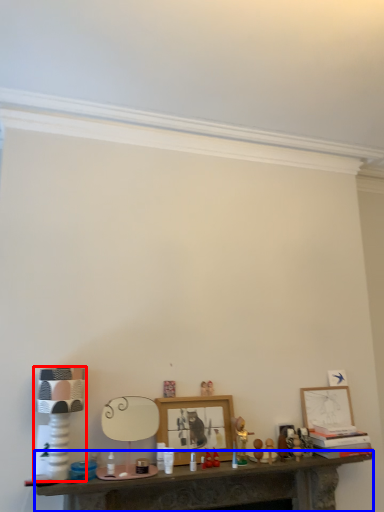
Question: Which object appears closest to the camera in this image, lamp (highlighted by a red box) or table (highlighted by a blue box)?

Choices:
 (A) lamp
 (B) table

Answer: (B)